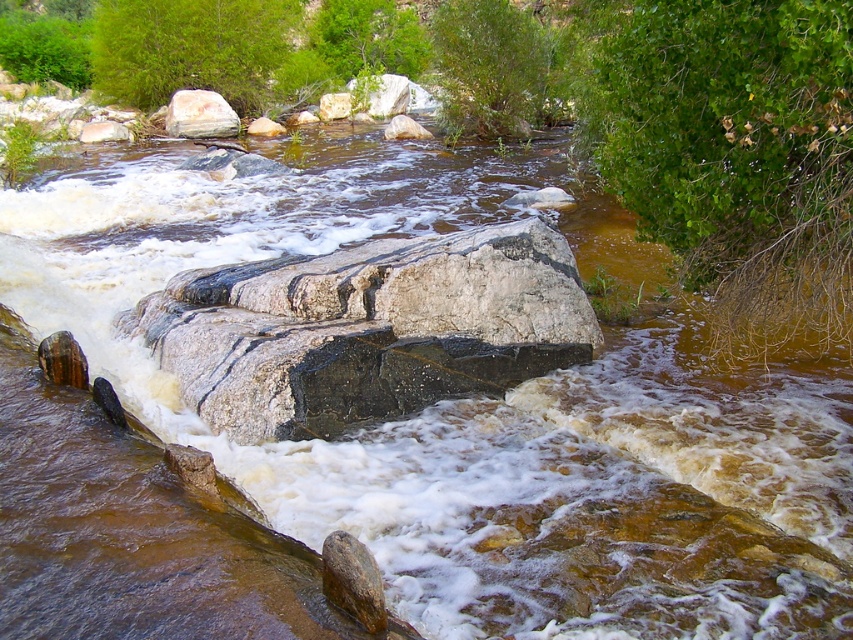
Question: Is gray/rough rock at upper center bigger than white marble rock at center?

Choices:
 (A) yes
 (B) no

Answer: (A)

Question: Which point appears farthest from the camera in this image?

Choices:
 (A) (322, 99)
 (B) (834, 157)

Answer: (A)

Question: Among these objects, which one is farthest from the camera?

Choices:
 (A) gray/rough rock at upper center
 (B) gray/granite rock at center
 (C) gray/rough rock at center
 (D) smooth gray rock at upper center

Answer: (D)

Question: Does green leafy bush at upper right have a lesser width compared to white smooth rock at center?

Choices:
 (A) no
 (B) yes

Answer: (B)

Question: Does gray/rough rock at upper center have a smaller size compared to gray/rough rock at center?

Choices:
 (A) yes
 (B) no

Answer: (B)

Question: Which point is closer to the camera?

Choices:
 (A) (386, 125)
 (B) (320, 115)

Answer: (A)